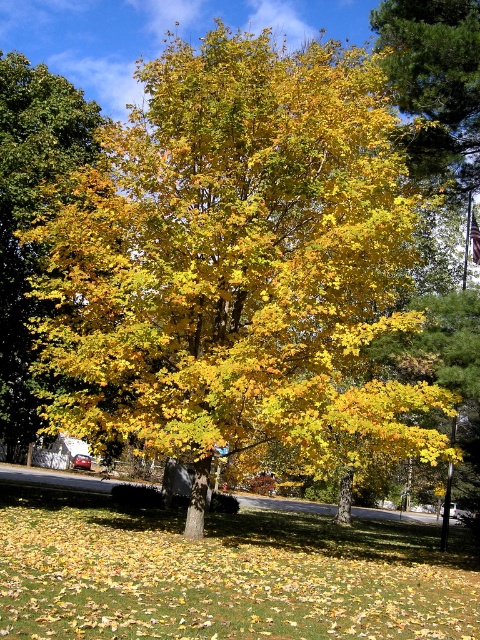
Who is positioned more to the right, yellow/golden leaves at center or golden yellow leaves at upper right?

Positioned to the right is golden yellow leaves at upper right.

Is yellow/golden leaves at center smaller than golden yellow leaves at upper right?

No.

Is point (20, 189) farther from camera compared to point (456, 144)?

No, it is not.

At what (x,y) coordinates should I click in order to perform the action: click on yellow/golden leaves at center. Please return your answer as a coordinate pair (x, y). The height and width of the screenshot is (640, 480). Looking at the image, I should click on (31, 214).

Does yellow-green leaves at center lie behind yellow/golden leaves at center?

No.

Is yellow-green leaves at center below yellow/golden leaves at center?

Yes, yellow-green leaves at center is below yellow/golden leaves at center.

Who is more forward, [160,620] or [6,368]?

Point [160,620] is more forward.

Locate an element on the screen. Image resolution: width=480 pixels, height=640 pixels. yellow-green leaves at center is located at coordinates (224, 573).

Does yellow-green leaves at center have a larger size compared to golden yellow leaves at upper right?

Yes.

Does yellow-green leaves at center have a greater width compared to golden yellow leaves at upper right?

Yes.

You are a GUI agent. You are given a task and a screenshot of the screen. Output one action in this format:
    pyautogui.click(x=<x>, y=<y>)
    Task: Click on the yellow-green leaves at center
    The height and width of the screenshot is (640, 480).
    Given the screenshot: What is the action you would take?
    pyautogui.click(x=224, y=573)